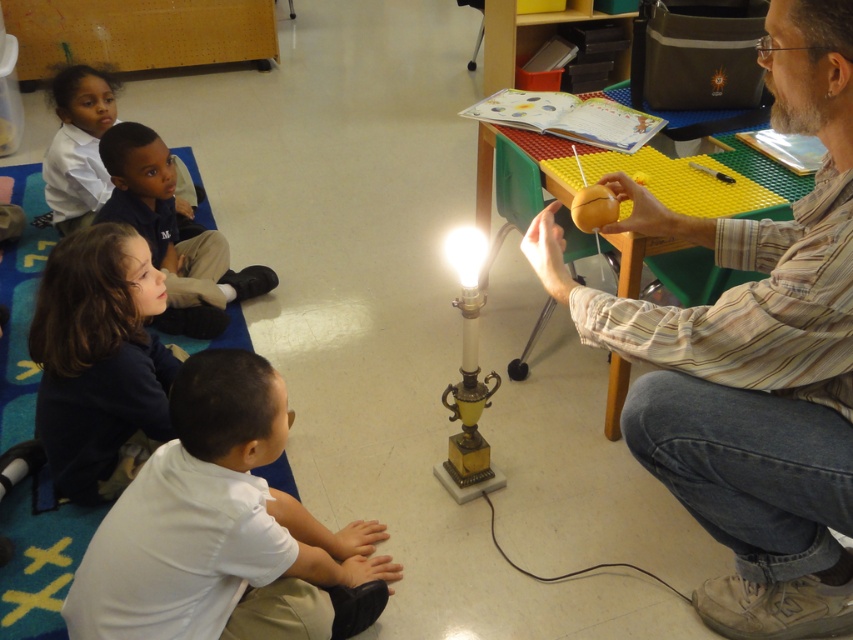
Question: Which of the following is the farthest from the observer?

Choices:
 (A) matte brown ball at right
 (B) matte white shirt at upper left

Answer: (B)

Question: Observing the image, what is the correct spatial positioning of brown uniform at lower left in reference to matte white shirt at upper left?

Choices:
 (A) above
 (B) below

Answer: (B)

Question: Can you confirm if white matte shirt at lower left is positioned above matte white shirt at upper left?

Choices:
 (A) no
 (B) yes

Answer: (A)

Question: Which of these objects is positioned closest to the matte brown ball at right?

Choices:
 (A) brown uniform at lower left
 (B) matte white shirt at upper left
 (C) dark blue shirt at lower left
 (D) white matte shirt at lower left

Answer: (D)

Question: In this image, where is brown uniform at lower left located relative to matte white shirt at upper left?

Choices:
 (A) right
 (B) left

Answer: (A)

Question: Among these points, which one is farthest from the camera?

Choices:
 (A) (807, 90)
 (B) (184, 563)

Answer: (B)